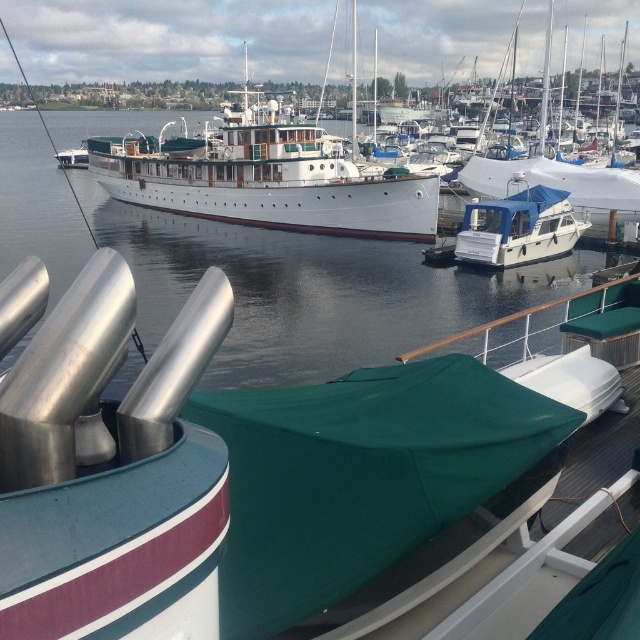
You are a dock worker trying to locate the polished stainless steel exhaust pipes at center. According to the coordinates provided, where exactly would you find them in the image?

The polished stainless steel exhaust pipes at center are located at point coordinates of (234, 465).

You are a dock worker who needs to guide a new boat to the pier. You see the white polished wood boat at center and the white matte sailboat at upper right. Which boat should you move first to allow the new boat to dock?

You should move the white polished wood boat at center first because it is positioned to the left of the white matte sailboat at upper right, so moving it would create space for the new boat to dock.

You are a dock worker who needs to attach a safety line to the polished stainless steel exhaust pipes at center and the white matte sailboat at upper right. Which object requires a thinner safety line based on their sizes?

The polished stainless steel exhaust pipes at center is thinner than the white matte sailboat at upper right, so the safety line for the polished stainless steel exhaust pipes at center should be thinner.